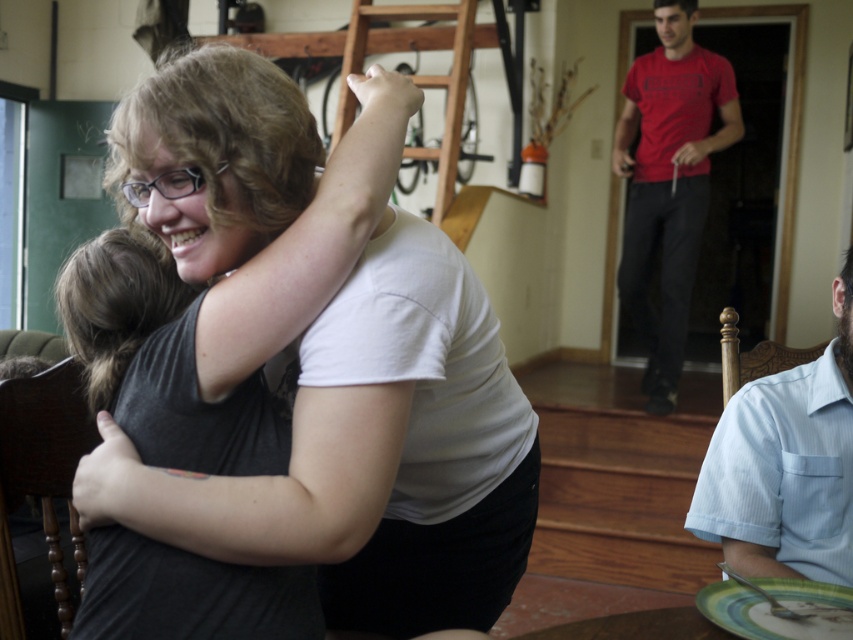
Between light blue striped shirt at lower right and green glazed plate at lower right, which one has less height?

green glazed plate at lower right

Does point (833, 307) lie in front of point (769, 579)?

No.

This screenshot has width=853, height=640. I want to click on light blue striped shirt at lower right, so click(786, 465).

Does point (358, 513) come behind point (850, 588)?

No, (358, 513) is closer to viewer.

Locate an element on the screen. This screenshot has width=853, height=640. white matte t-shirt at center is located at coordinates (373, 454).

Does point (408, 531) lie behind point (733, 600)?

That is True.

Find the location of `white matte t-shirt at center`. white matte t-shirt at center is located at coordinates (373, 454).

Which is more to the right, light blue striped shirt at lower right or red cotton t-shirt at right?

From the viewer's perspective, red cotton t-shirt at right appears more on the right side.

The image size is (853, 640). I want to click on light blue striped shirt at lower right, so click(x=786, y=465).

Is point (770, 467) closer to camera compared to point (688, 28)?

Yes, it is in front of point (688, 28).

Where is `light blue striped shirt at lower right`? light blue striped shirt at lower right is located at coordinates (786, 465).